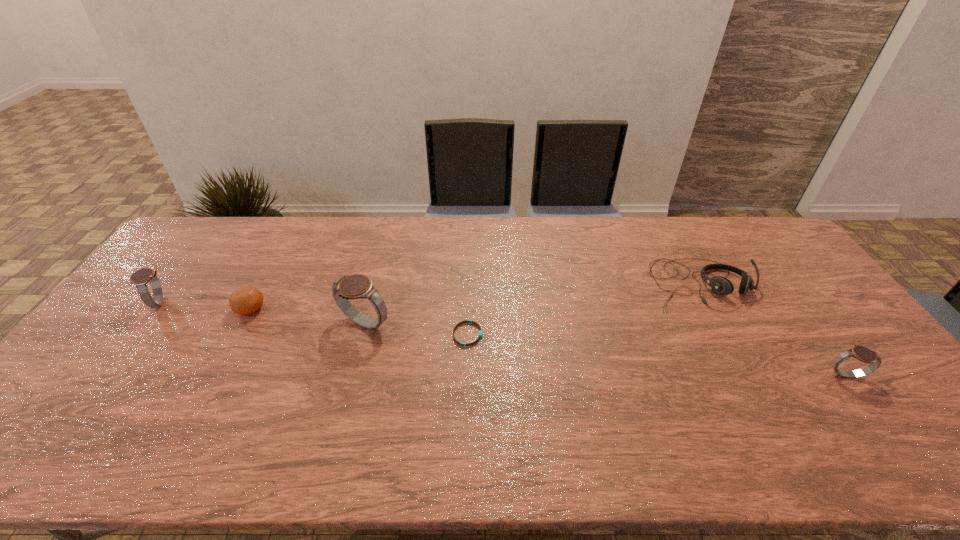
The image size is (960, 540). I want to click on free spot at the right edge of the desktop, so click(x=801, y=313).

Identify the location of free space at the far left corner of the desktop. The height and width of the screenshot is (540, 960). (203, 230).

At what (x,y) coordinates should I click in order to perform the action: click on empty location between the third object from left to right and the second shortest watch. Please return your answer as a coordinate pair (x, y). The width and height of the screenshot is (960, 540). Looking at the image, I should click on [262, 313].

Where is `vacant space that is in between the headset and the second watch from right to left`? The height and width of the screenshot is (540, 960). vacant space that is in between the headset and the second watch from right to left is located at coordinates (532, 305).

At what (x,y) coordinates should I click in order to perform the action: click on vacant area that lies between the leftmost object and the headset. Please return your answer as a coordinate pair (x, y). Looking at the image, I should click on (430, 294).

What are the coordinates of `free spot between the second shortest watch and the rightmost watch` in the screenshot? It's located at (502, 339).

Identify the location of free spot between the second watch from left to right and the fifth object from right to left. (307, 316).

The height and width of the screenshot is (540, 960). What are the coordinates of `vacant space that is in between the rightmost watch and the fifth object from right to left` in the screenshot? It's located at (548, 342).

Locate an element on the screen. vacant area between the tallest object and the fifth object from right to left is located at coordinates (307, 316).

Where is `vacant space that's between the leftmost watch and the nearest object`? This screenshot has width=960, height=540. vacant space that's between the leftmost watch and the nearest object is located at coordinates (502, 339).